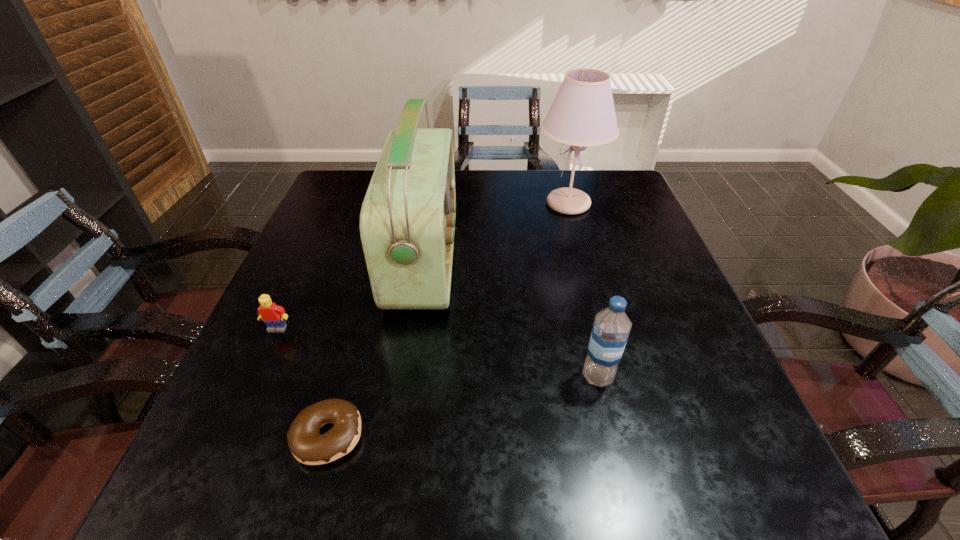
Where is `free point that satisfies the following two spatial constraints: 1. on the front panel of the radio receiver; 2. on the front-facing side of the leftmost object`? free point that satisfies the following two spatial constraints: 1. on the front panel of the radio receiver; 2. on the front-facing side of the leftmost object is located at coordinates (414, 328).

Locate an element on the screen. vacant area in the image that satisfies the following two spatial constraints: 1. on the front panel of the radio receiver; 2. on the front-facing side of the fourth tallest object is located at coordinates (414, 328).

You are a GUI agent. You are given a task and a screenshot of the screen. Output one action in this format:
    pyautogui.click(x=<x>, y=<y>)
    Task: Click on the vacant space that satisfies the following two spatial constraints: 1. on the front-facing side of the Lego; 2. on the left side of the doughnut
    
    Given the screenshot: What is the action you would take?
    pyautogui.click(x=229, y=435)

The width and height of the screenshot is (960, 540). What are the coordinates of `vacant area that satisfies the following two spatial constraints: 1. on the back side of the nearest object; 2. on the left side of the lampshade` in the screenshot? It's located at (391, 204).